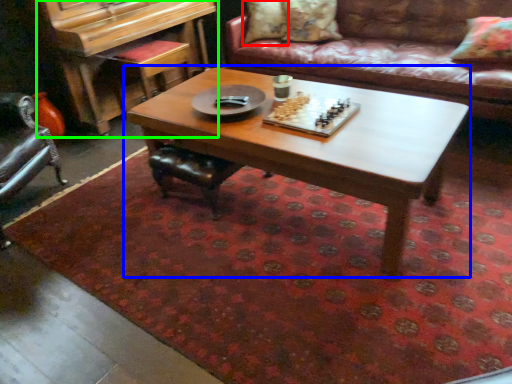
Question: Which is nearer to the pillow (highlighted by a red box)? coffee table (highlighted by a blue box) or piano (highlighted by a green box).

Choices:
 (A) coffee table
 (B) piano

Answer: (B)